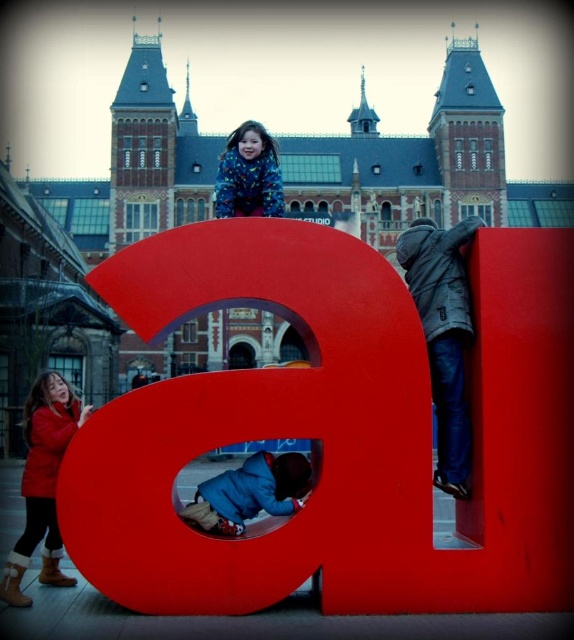
Does blue fleece jacket at lower center have a lesser width compared to fluffy blue jacket at center?

In fact, blue fleece jacket at lower center might be wider than fluffy blue jacket at center.

Does blue fleece jacket at lower center have a smaller size compared to fluffy blue jacket at center?

Correct, blue fleece jacket at lower center occupies less space than fluffy blue jacket at center.

Which is in front, point (184, 518) or point (281, 195)?

Point (184, 518) is more forward.

Where is `blue fleece jacket at lower center`? blue fleece jacket at lower center is located at coordinates (250, 493).

Does dark gray jacket at right lie in front of fluffy blue jacket at center?

Yes, dark gray jacket at right is in front of fluffy blue jacket at center.

Is dark gray jacket at right wider than fluffy blue jacket at center?

Correct, the width of dark gray jacket at right exceeds that of fluffy blue jacket at center.

Is point (444, 394) farther from viewer compared to point (245, 160)?

No, it is not.

Find the location of a particular element. dark gray jacket at right is located at coordinates (444, 336).

Does red leather coat at lower left have a lesser width compared to fluffy blue jacket at center?

Indeed, red leather coat at lower left has a lesser width compared to fluffy blue jacket at center.

How distant is red leather coat at lower left from fluffy blue jacket at center?

red leather coat at lower left is 27.38 meters away from fluffy blue jacket at center.

At what (x,y) coordinates should I click in order to perform the action: click on red leather coat at lower left. Please return your answer as a coordinate pair (x, y). Image resolution: width=574 pixels, height=640 pixels. Looking at the image, I should click on (42, 483).